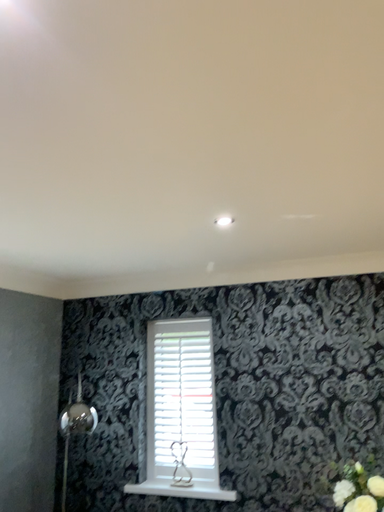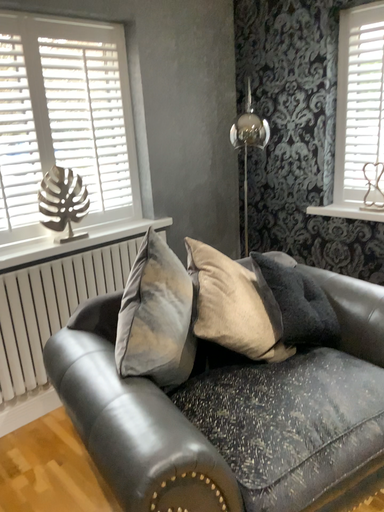
Question: How did the camera likely rotate when shooting the video?

Choices:
 (A) rotated right
 (B) rotated left

Answer: (B)